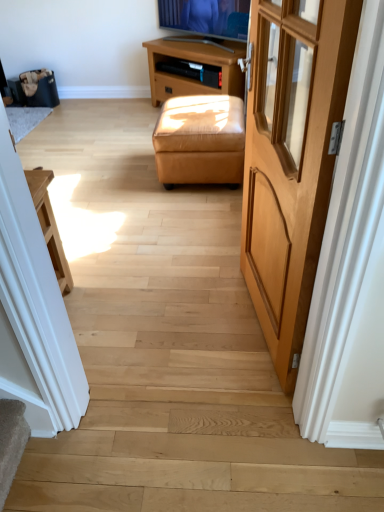
What is the approximate width of brown wooden tv stand at upper center?

It is 14.06 inches.

Describe the element at coordinates (200, 140) in the screenshot. The height and width of the screenshot is (512, 384). I see `tan leather ottoman at center` at that location.

Locate an element on the screen. Image resolution: width=384 pixels, height=512 pixels. brown wooden tv stand at upper center is located at coordinates (197, 63).

Does tan leather ottoman at center turn towards brown wooden tv stand at upper center?

No.

Which object is closer to the camera taking this photo, tan leather ottoman at center or brown wooden tv stand at upper center?

tan leather ottoman at center is in front.

Considering the sizes of tan leather ottoman at center and brown wooden tv stand at upper center in the image, is tan leather ottoman at center wider or thinner than brown wooden tv stand at upper center?

tan leather ottoman at center is wider than brown wooden tv stand at upper center.

From a real-world perspective, is tan leather ottoman at center above or below brown wooden tv stand at upper center?

From a real-world perspective, tan leather ottoman at center is physically below brown wooden tv stand at upper center.

The height and width of the screenshot is (512, 384). I want to click on door that appears above the brown wooden tv stand at upper center (from a real-world perspective), so click(291, 160).

Is light brown wood door at right touching brown wooden tv stand at upper center?

light brown wood door at right is not next to brown wooden tv stand at upper center, and they're not touching.

From the image's perspective, is light brown wood door at right located above or below brown wooden tv stand at upper center?

From the image's perspective, light brown wood door at right appears below brown wooden tv stand at upper center.

Considering the relative sizes of light brown wood door at right and brown wooden tv stand at upper center in the image provided, is light brown wood door at right shorter than brown wooden tv stand at upper center?

In fact, light brown wood door at right may be taller than brown wooden tv stand at upper center.

From a real-world perspective, is tan leather ottoman at center located higher than light brown wood door at right?

No, from a real-world perspective, tan leather ottoman at center is not over light brown wood door at right

Between tan leather ottoman at center and light brown wood door at right, which one appears on the left side from the viewer's perspective?

From the viewer's perspective, tan leather ottoman at center appears more on the left side.

Is tan leather ottoman at center completely or partially outside of light brown wood door at right?

Indeed, tan leather ottoman at center is completely outside light brown wood door at right.

Who is bigger, tan leather ottoman at center or light brown wood door at right?

With larger size is tan leather ottoman at center.

Based on the photo, which of these two, brown wooden tv stand at upper center or tan leather ottoman at center, stands shorter?

tan leather ottoman at center is shorter.

Is point (243, 76) positioned behind point (242, 165)?

Yes, it is.

Is brown wooden tv stand at upper center oriented away from tan leather ottoman at center?

No.

In the scene shown: Is brown wooden tv stand at upper center inside or outside of tan leather ottoman at center?

brown wooden tv stand at upper center lies outside tan leather ottoman at center.

Considering the positions of points (204, 62) and (327, 68), is point (204, 62) farther from camera compared to point (327, 68)?

That is True.

From the image's perspective, is brown wooden tv stand at upper center beneath light brown wood door at right?

No.

Is light brown wood door at right a part of brown wooden tv stand at upper center?

No.

Considering the sizes of brown wooden tv stand at upper center and light brown wood door at right in the image, is brown wooden tv stand at upper center wider or thinner than light brown wood door at right?

Clearly, brown wooden tv stand at upper center has more width compared to light brown wood door at right.

Is point (274, 208) positioned in front of point (165, 106)?

Yes, it is.

Considering the relative sizes of light brown wood door at right and tan leather ottoman at center in the image provided, is light brown wood door at right bigger than tan leather ottoman at center?

No, light brown wood door at right is not bigger than tan leather ottoman at center.

Between light brown wood door at right and tan leather ottoman at center, which one is positioned in front?

light brown wood door at right is in front.

The height and width of the screenshot is (512, 384). Identify the location of stool on the right of brown wooden tv stand at upper center. (200, 140).

This screenshot has width=384, height=512. I want to click on table to the left of light brown wood door at right, so click(x=197, y=63).

Which object lies nearer to the anchor point tan leather ottoman at center, brown wooden tv stand at upper center or light brown wood door at right?

Based on the image, brown wooden tv stand at upper center appears to be nearer to tan leather ottoman at center.

Looking at the image, which one is located closer to brown wooden tv stand at upper center, light brown wood door at right or tan leather ottoman at center?

tan leather ottoman at center lies closer to brown wooden tv stand at upper center than the other object.

Based on their spatial positions, is tan leather ottoman at center or brown wooden tv stand at upper center further from light brown wood door at right?

The object further to light brown wood door at right is brown wooden tv stand at upper center.

Estimate the real-world distances between objects in this image. Which object is further from brown wooden tv stand at upper center, tan leather ottoman at center or light brown wood door at right?

light brown wood door at right is positioned further to the anchor brown wooden tv stand at upper center.

In the scene shown: Looking at the image, which one is located further to light brown wood door at right, brown wooden tv stand at upper center or tan leather ottoman at center?

brown wooden tv stand at upper center is further to light brown wood door at right.

Considering their positions, is light brown wood door at right positioned closer to tan leather ottoman at center than brown wooden tv stand at upper center?

brown wooden tv stand at upper center is positioned closer to the anchor tan leather ottoman at center.

This screenshot has height=512, width=384. In order to click on stool between light brown wood door at right and brown wooden tv stand at upper center from front to back in this screenshot , I will do tap(200, 140).